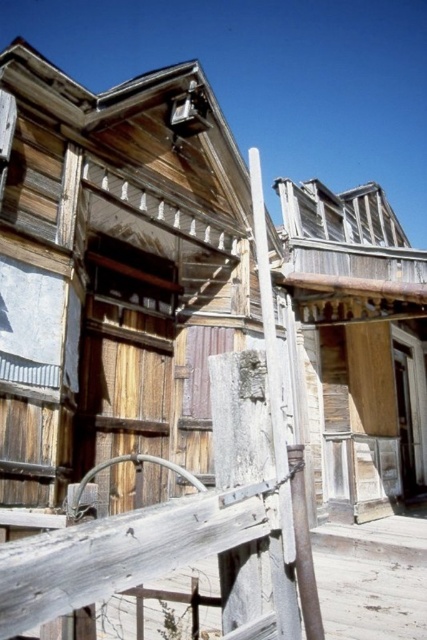
You are standing at the origin point of the image coordinate system. You want to walk to the weathered wood fence at center. In which direction should you move relative to your current position?

The weathered wood fence at center is located at coordinate point 0.831 on the x axis and 0.440 on the y axis. Since you are at the origin point, you should move towards the positive x and positive y direction to reach it.

You are standing at the point labeled as point (187,531) in the image. Looking around, you see a weathered wood fence at center and a metal pipe coiled around it. Which object is closer to you at that point?

The weathered wood fence at center is closer to you at point (187,531) because the metal pipe is coiled around it, indicating proximity.